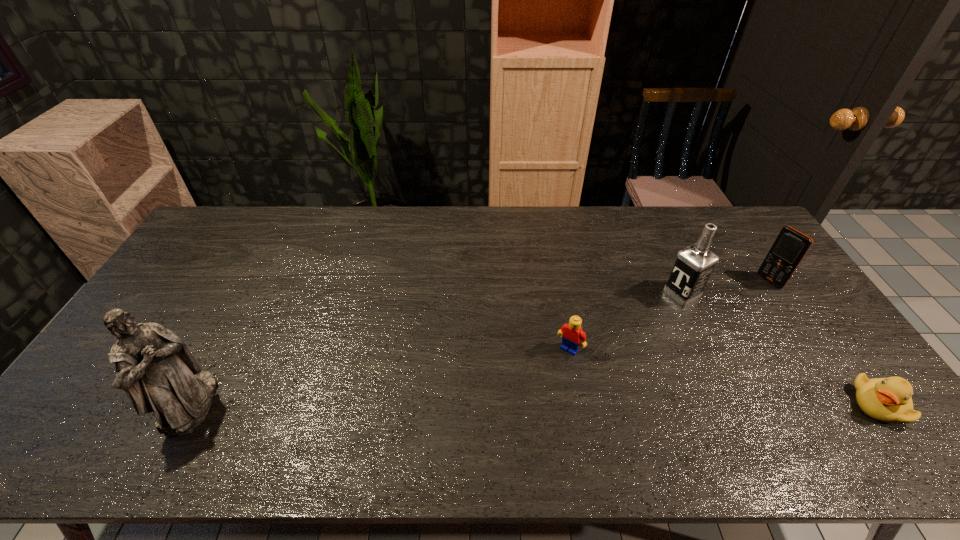
Locate an element on the screen. Image resolution: width=960 pixels, height=540 pixels. duckling that is at the near edge is located at coordinates (888, 400).

Identify the location of duckling that is positioned at the right edge. Image resolution: width=960 pixels, height=540 pixels. (888, 400).

This screenshot has height=540, width=960. What are the coordinates of `cellular telephone that is at the right edge` in the screenshot? It's located at (790, 247).

Find the location of a particular element. This screenshot has width=960, height=540. object located in the near right corner section of the desktop is located at coordinates (888, 400).

In the image, there is a desktop. At what (x,y) coordinates should I click in order to perform the action: click on vacant space at the far edge. Please return your answer as a coordinate pair (x, y). This screenshot has width=960, height=540. Looking at the image, I should click on (673, 211).

At what (x,y) coordinates should I click in order to perform the action: click on free space at the near edge of the desktop. Please return your answer as a coordinate pair (x, y). Image resolution: width=960 pixels, height=540 pixels. Looking at the image, I should click on (686, 411).

In the image, there is a desktop. Find the location of `vacant space at the far right corner`. vacant space at the far right corner is located at coordinates (743, 228).

What are the coordinates of `free space between the shortest object and the third nearest object` in the screenshot? It's located at (725, 376).

Find the location of a particular element. The height and width of the screenshot is (540, 960). blank region between the second shortest object and the tallest object is located at coordinates (379, 376).

Where is `vacant space that is in between the fourth object from right to left and the duckling`? The height and width of the screenshot is (540, 960). vacant space that is in between the fourth object from right to left and the duckling is located at coordinates (725, 376).